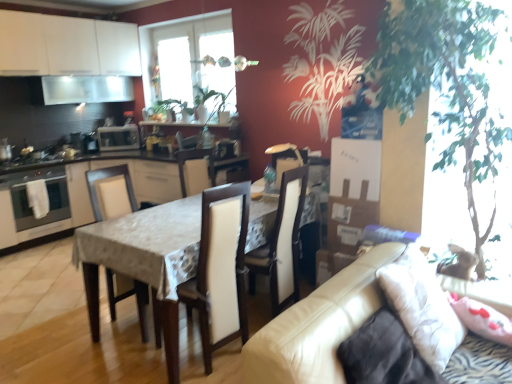
Question: Would you say leather couch at lower right is to the left or to the right of white fabric pillow at right in the picture?

Choices:
 (A) left
 (B) right

Answer: (A)

Question: Is leather couch at lower right taller or shorter than white fabric pillow at right?

Choices:
 (A) short
 (B) tall

Answer: (B)

Question: Which is nearer to the satin silver oven at left?

Choices:
 (A) leather couch at lower right
 (B) white fabric chair at center, arranged as the 1th chair when viewed from the left
 (C) white glossy cabinets at center, positioned as the 2th cabinetry in top-to-bottom order
 (D) green leafy plant at right
 (E) transparent glass window at upper center

Answer: (C)

Question: Which of these objects is positioned closest to the white fabric chair at center, arranged as the 1th chair when viewed from the left?

Choices:
 (A) white glossy cabinets at center, positioned as the 2th cabinetry in top-to-bottom order
 (B) leather couch at lower right
 (C) wooden chair at center, the 2th chair from the right
 (D) transparent glass window at upper center
 (E) transparent glass window screen at upper center

Answer: (C)